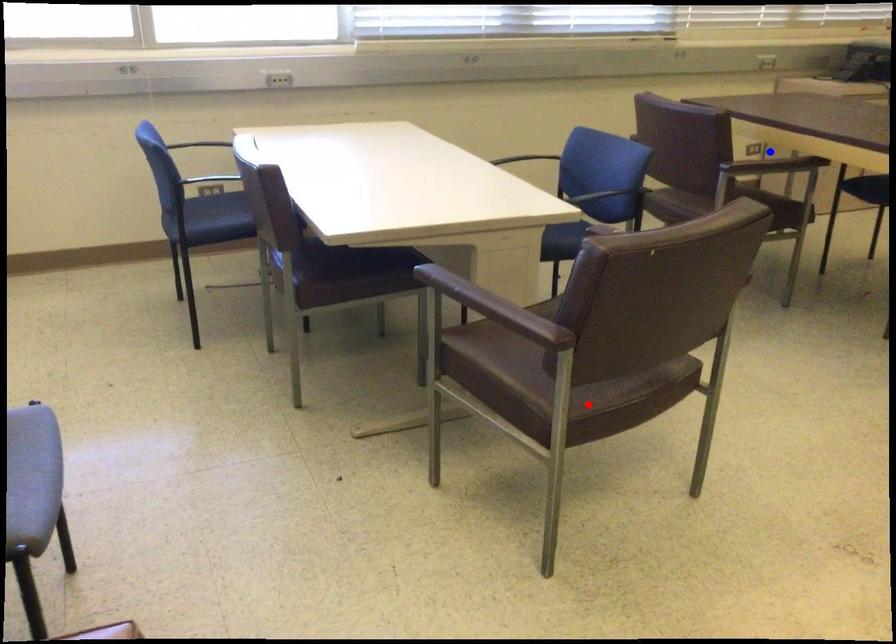
Question: Two points are marked on the image. Which point is closer to the camera?

Choices:
 (A) Blue point is closer.
 (B) Red point is closer.

Answer: (B)